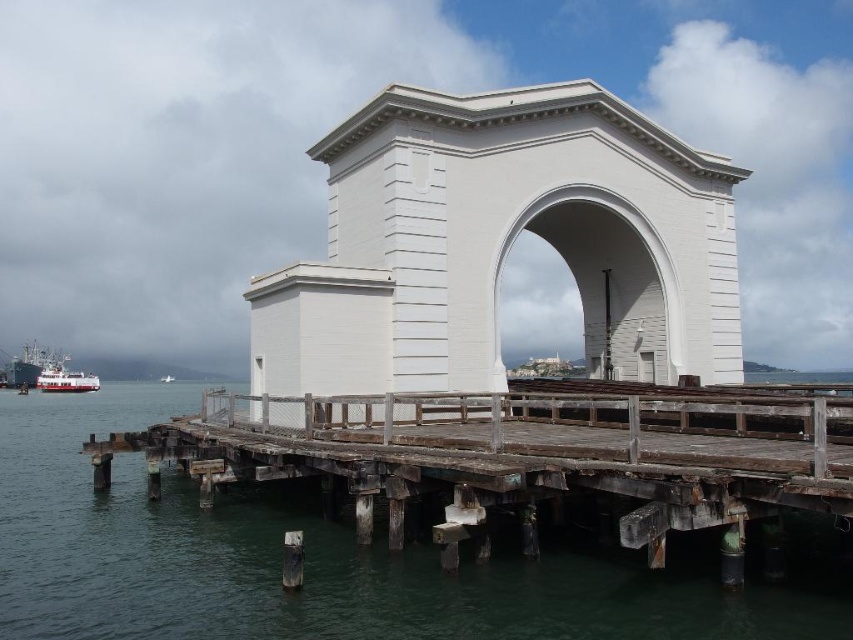
Where is `white matte archway at center`? The image size is (853, 640). white matte archway at center is located at coordinates (612, 280).

Does white matte archway at center have a larger size compared to white glossy boat at lower left?

No, white matte archway at center is not bigger than white glossy boat at lower left.

Who is more forward, [592,324] or [62,364]?

Point [592,324] is in front.

The image size is (853, 640). Identify the location of white matte archway at center. (612, 280).

How much distance is there between transparent water at lower left and white glossy boat at lower left?

The distance of transparent water at lower left from white glossy boat at lower left is 327.83 feet.

Does transparent water at lower left have a greater height compared to white glossy boat at lower left?

Incorrect, transparent water at lower left's height is not larger of white glossy boat at lower left's.

The height and width of the screenshot is (640, 853). Find the location of `transparent water at lower left`. transparent water at lower left is located at coordinates (306, 561).

Does transparent water at lower left have a larger size compared to white matte archway at center?

Yes, transparent water at lower left is bigger than white matte archway at center.

Can you confirm if transparent water at lower left is positioned below white matte archway at center?

Correct, transparent water at lower left is located below white matte archway at center.

Is point (241, 632) farther from camera compared to point (674, 307)?

No, (241, 632) is closer to viewer.

What are the coordinates of `transparent water at lower left` in the screenshot? It's located at (306, 561).